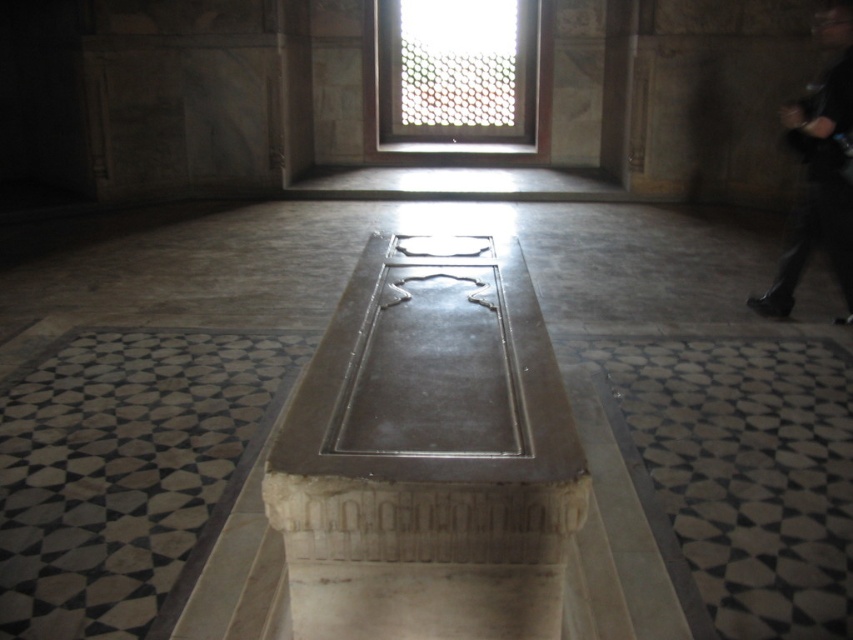
Is polished stone sarcophagus at center above clear glass lattice at upper center?

Incorrect, polished stone sarcophagus at center is not positioned above clear glass lattice at upper center.

Image resolution: width=853 pixels, height=640 pixels. What do you see at coordinates (428, 456) in the screenshot? I see `polished stone sarcophagus at center` at bounding box center [428, 456].

Identify the location of polished stone sarcophagus at center. (x=428, y=456).

Which is in front, point (440, 108) or point (798, 115)?

Point (798, 115)

Is clear glass lattice at upper center in front of black fabric at right?

No, it is behind black fabric at right.

Where is `clear glass lattice at upper center`? The image size is (853, 640). clear glass lattice at upper center is located at coordinates (456, 74).

Between polished stone sarcophagus at center and black fabric at right, which one has more height?

Standing taller between the two is black fabric at right.

Is polished stone sarcophagus at center positioned behind black fabric at right?

No, it is not.

The width and height of the screenshot is (853, 640). I want to click on polished stone sarcophagus at center, so click(x=428, y=456).